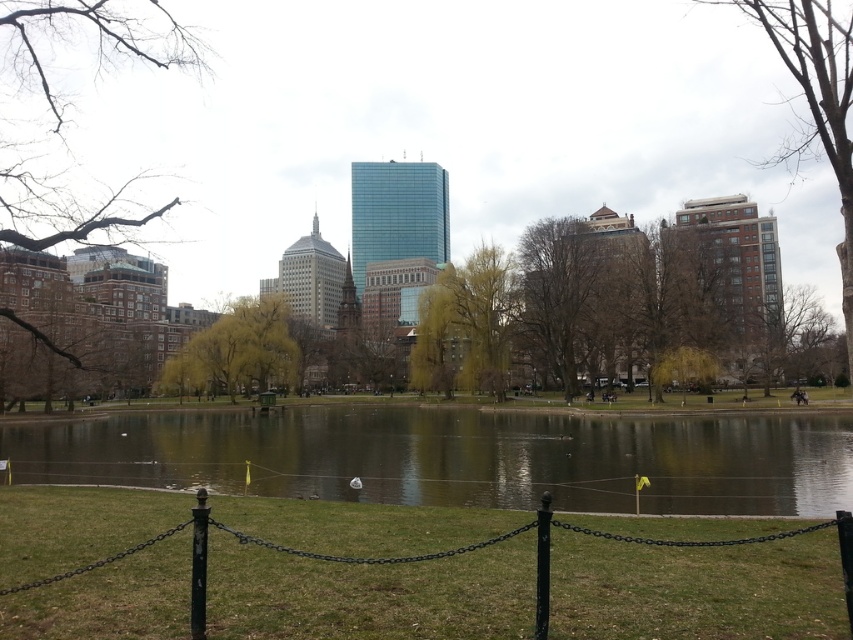
You are standing at the center of the park and want to take a photo of the brown textured building at right. Given that your camera has a 60 degree field of view, can you capture the entire building in one shot without moving?

The brown textured building at right is located at point (816, 100), which is within the 60 degree field of view of the camera when positioned at the center of the park. Therefore, you can capture the entire building in one shot without moving.